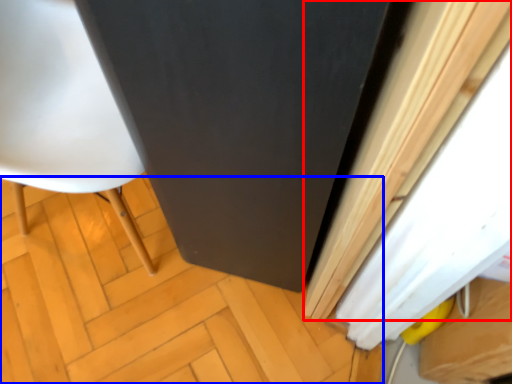
Question: Which point is further to the camera, curtain (highlighted by a red box) or plywood (highlighted by a blue box)?

Choices:
 (A) curtain
 (B) plywood

Answer: (B)